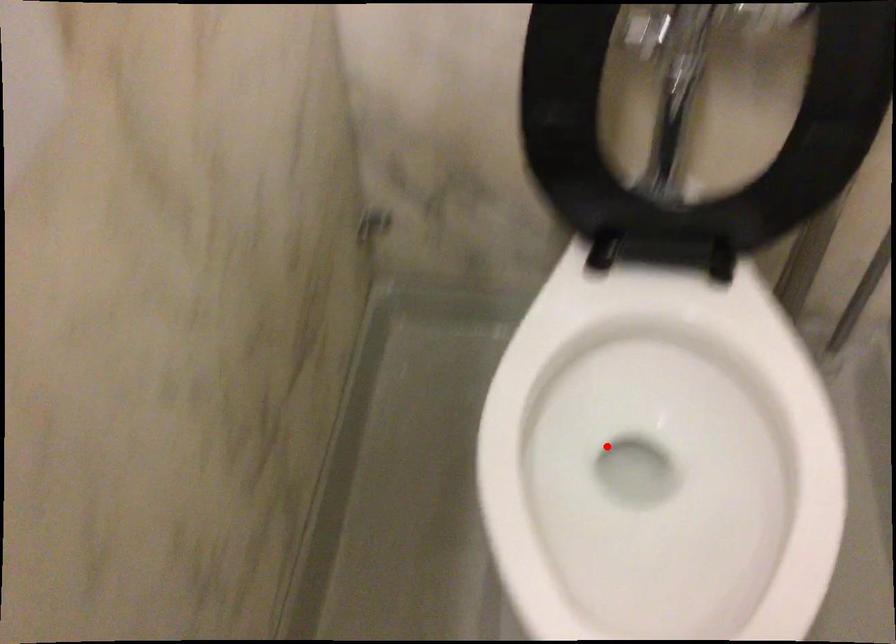
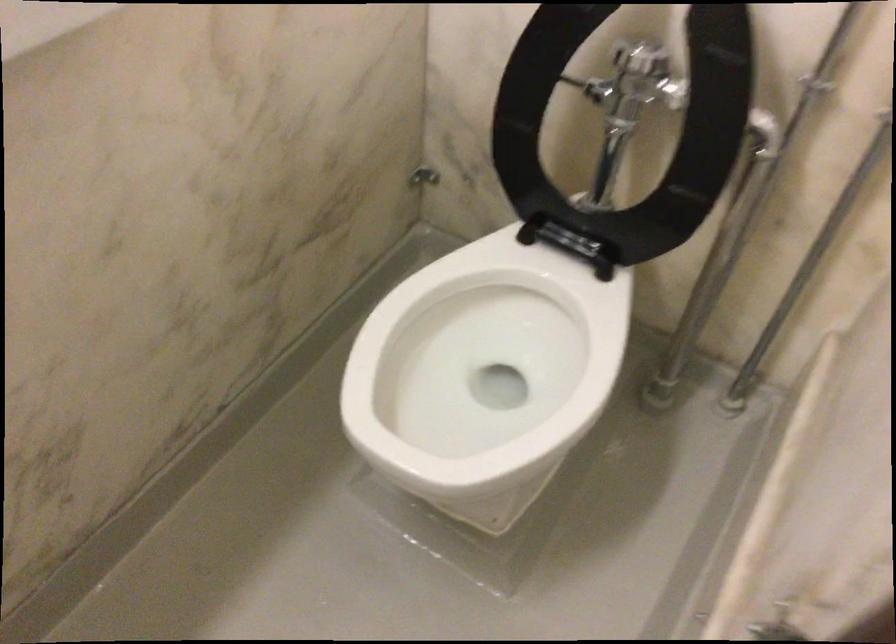
Question: I am providing you with two images of the same scene from different viewpoints. Given a red point in image1, look at the same physical point in image2. Is it:

Choices:
 (A) Closer to the viewpoint
 (B) Farther from the viewpoint

Answer: (B)